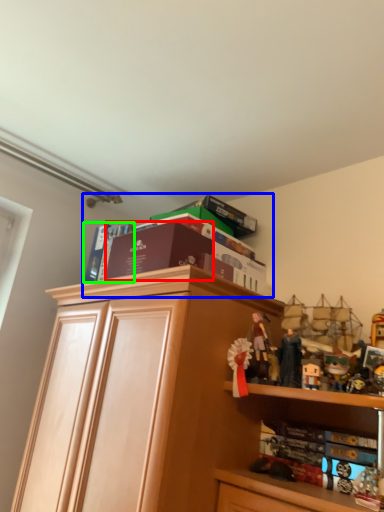
Question: Estimate the real-world distances between objects in this image. Which object is closer to book (highlighted by a red box), book (highlighted by a blue box) or book (highlighted by a green box)?

Choices:
 (A) book
 (B) book

Answer: (A)